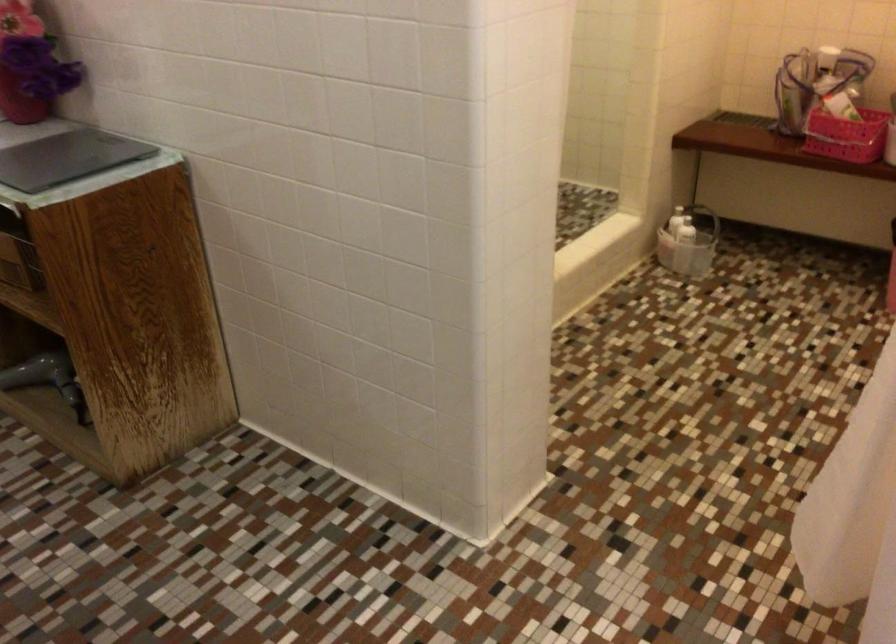
The location [30,64] corresponds to which object?

This point indicates the red vase.